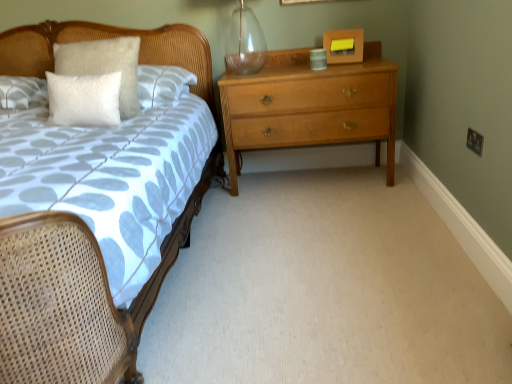
What do you see at coordinates (310, 106) in the screenshot? The image size is (512, 384). I see `light brown wood chest of drawers at center` at bounding box center [310, 106].

I want to click on light brown wood chest of drawers at center, so click(x=310, y=106).

Measure the distance between point (77, 84) and camera.

Point (77, 84) is 2.05 meters from camera.

Locate an element on the screen. The image size is (512, 384). white textured pillow at upper left is located at coordinates (106, 38).

Can you confirm if light brown wood chest of drawers at center is bigger than transparent glass vase at upper center?

Indeed, light brown wood chest of drawers at center has a larger size compared to transparent glass vase at upper center.

From the image's perspective, between light brown wood chest of drawers at center and transparent glass vase at upper center, who is located below?

light brown wood chest of drawers at center is shown below in the image.

Is light brown wood chest of drawers at center placed right next to transparent glass vase at upper center?

There is a gap between light brown wood chest of drawers at center and transparent glass vase at upper center.

Can you confirm if white fluffy pillow at upper left is bigger than light brown wood chest of drawers at center?

No, white fluffy pillow at upper left is not bigger than light brown wood chest of drawers at center.

Is white fluffy pillow at upper left to the left of light brown wood chest of drawers at center from the viewer's perspective?

Correct, you'll find white fluffy pillow at upper left to the left of light brown wood chest of drawers at center.

Is white fluffy pillow at upper left far from light brown wood chest of drawers at center?

No, white fluffy pillow at upper left is not far away from light brown wood chest of drawers at center.

How different are the orientations of white fluffy pillow at upper left and light brown wood chest of drawers at center in degrees?

white fluffy pillow at upper left and light brown wood chest of drawers at center are facing 1.7 degrees away from each other.

Can you confirm if white textured pillow at upper left is positioned to the left of light brown wood chest of drawers at center?

Correct, you'll find white textured pillow at upper left to the left of light brown wood chest of drawers at center.

From a real-world perspective, is white textured pillow at upper left located higher than light brown wood chest of drawers at center?

A: Yes, from a real-world perspective, white textured pillow at upper left is over light brown wood chest of drawers at center

Does point (201, 52) lie in front of point (305, 135)?

No, it is behind (305, 135).

Between white textured pillow at upper left and light brown wood chest of drawers at center, which one has smaller size?

Smaller between the two is white textured pillow at upper left.

How many degrees apart are the facing directions of light brown wood chest of drawers at center and wooden bed at left?

The angle between the facing direction of light brown wood chest of drawers at center and the facing direction of wooden bed at left is 0.595 degrees.

Does light brown wood chest of drawers at center touch wooden bed at left?

They are not placed beside each other.

From the image's perspective, between light brown wood chest of drawers at center and wooden bed at left, who is located below?

wooden bed at left, from the image's perspective.

Which is behind, point (243, 17) or point (60, 94)?

The point (243, 17) is farther.

From the image's perspective, between transparent glass vase at upper center and white fluffy pillow at upper left, who is located below?

white fluffy pillow at upper left, from the image's perspective.

Who is more distant, transparent glass vase at upper center or white fluffy pillow at upper left?

transparent glass vase at upper center is further from the camera.

Is transparent glass vase at upper center at the left side of white fluffy pillow at upper left?

No.

Considering the positions of points (232, 187) and (86, 108), is point (232, 187) closer to camera compared to point (86, 108)?

No.

Does light brown wood chest of drawers at center lie behind white fluffy pillow at upper left?

Yes, it is behind white fluffy pillow at upper left.

Can you see light brown wood chest of drawers at center touching white fluffy pillow at upper left?

light brown wood chest of drawers at center and white fluffy pillow at upper left are clearly separated.

From the image's perspective, which is below, transparent glass vase at upper center or wooden bed at left?

wooden bed at left.

Does point (242, 58) come closer to viewer compared to point (42, 40)?

No, it is not.

From a real-world perspective, which object stands above the other?

From a 3D spatial view, transparent glass vase at upper center is above.

Is transparent glass vase at upper center next to wooden bed at left and touching it?

No, transparent glass vase at upper center is not making contact with wooden bed at left.

At what (x,y) coordinates should I click in order to perform the action: click on the chest of drawers that is below the transparent glass vase at upper center (from the image's perspective). Please return your answer as a coordinate pair (x, y). The height and width of the screenshot is (384, 512). Looking at the image, I should click on (310, 106).

The image size is (512, 384). I want to click on pillow in front of the light brown wood chest of drawers at center, so click(x=84, y=99).

Considering their positions, is white fluffy pillow at upper left positioned closer to transparent glass vase at upper center than white textured pillow at upper left?

white textured pillow at upper left is closer to transparent glass vase at upper center.

Based on their spatial positions, is white textured pillow at upper left or wooden bed at left further from white fluffy pillow at upper left?

Based on the image, white textured pillow at upper left appears to be further to white fluffy pillow at upper left.

Consider the image. When comparing their distances from wooden bed at left, does light brown wood chest of drawers at center or white textured pillow at upper left seem further?

light brown wood chest of drawers at center is further to wooden bed at left.

Looking at the image, which one is located further to light brown wood chest of drawers at center, white textured pillow at upper left or wooden bed at left?

wooden bed at left is further to light brown wood chest of drawers at center.

Looking at the image, which one is located closer to light brown wood chest of drawers at center, white textured pillow at upper left or transparent glass vase at upper center?

Among the two, transparent glass vase at upper center is located nearer to light brown wood chest of drawers at center.

Estimate the real-world distances between objects in this image. Which object is closer to white textured pillow at upper left, transparent glass vase at upper center or light brown wood chest of drawers at center?

Among the two, transparent glass vase at upper center is located nearer to white textured pillow at upper left.

Based on their spatial positions, is white textured pillow at upper left or transparent glass vase at upper center closer to wooden bed at left?

white textured pillow at upper left is closer to wooden bed at left.

When comparing their distances from white fluffy pillow at upper left, does white textured pillow at upper left or transparent glass vase at upper center seem further?

The object further to white fluffy pillow at upper left is transparent glass vase at upper center.

Identify the location of headboard positioned between wooden bed at left and light brown wood chest of drawers at center from near to far. The image size is (512, 384). (106, 38).

The height and width of the screenshot is (384, 512). I want to click on pillow between wooden bed at left and transparent glass vase at upper center along the z-axis, so click(84, 99).

The width and height of the screenshot is (512, 384). What are the coordinates of `headboard located between wooden bed at left and transparent glass vase at upper center in the depth direction` in the screenshot? It's located at (106, 38).

The image size is (512, 384). I want to click on pillow between wooden bed at left and white textured pillow at upper left in the front-back direction, so click(x=84, y=99).